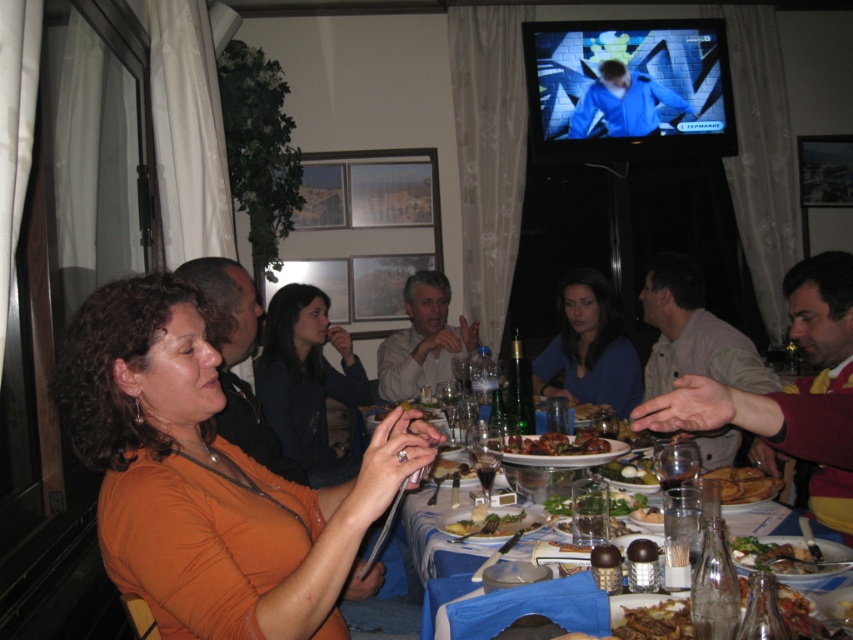
You are a photographer trying to capture a candid shot of the light gray shirt at center and the golden brown bread at lower right. Based on their positions, which object should you focus on first if you want to include both in your frame without moving the camera?

The light gray shirt at center is to the left of the golden brown bread at lower right. Since the light gray shirt is positioned to the left, you should focus on it first and then pan slightly to the right to include the golden brown bread at lower right in the frame.

You are a photographer standing at the camera position in the scene. You want to capture a closeup shot of the light gray shirt at center. Given that the camera has a minimum focusing distance of 2 meters, will you be able to take the photo without moving closer?

The light gray shirt at center is 3.48 meters away from the camera, which is beyond the minimum focusing distance of 2 meters. Therefore, you can take the photo without needing to move closer.

You are a guest at this dinner and want to place your napkin on the table. Where exactly should you place it to ensure it is near the dark blue sweater at center?

The dark blue sweater at center is located at point (306, 381), so you should place your napkin near that coordinate to ensure it is close to the dark blue sweater at center.